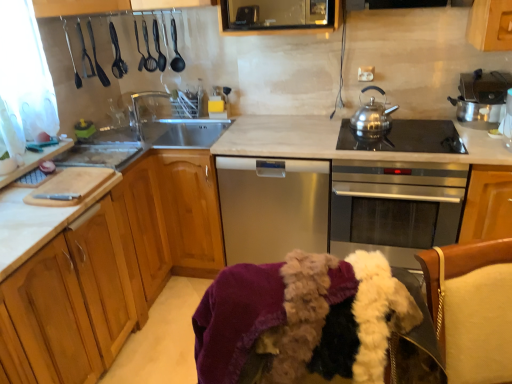
Question: Considering the positions of stainless steel teapot at upper right and stainless steel oven at center in the image, is stainless steel teapot at upper right taller or shorter than stainless steel oven at center?

Choices:
 (A) short
 (B) tall

Answer: (A)

Question: From a real-world perspective, is stainless steel teapot at upper right positioned above or below stainless steel oven at center?

Choices:
 (A) below
 (B) above

Answer: (B)

Question: Which object is positioned closest to the wooden cabinet at center, which is counted as the first cabinetry, starting from the right?

Choices:
 (A) stainless steel oven at center
 (B) black plastic spoon at upper center, arranged as the 1th appliance when viewed from the top
 (C) satin silver dishwasher at center
 (D) black glass cooktop at center-right
 (E) shiny metallic pot at upper right, the second appliance from the top

Answer: (C)

Question: Which object is positioned farthest from the white marble countertop at center?

Choices:
 (A) stainless steel oven at center
 (B) wooden cabinet at center, which ranks as the second cabinetry in left-to-right order
 (C) shiny metallic pot at upper right, arranged as the first appliance when viewed from the right
 (D) transparent glass tap at center
 (E) black glass cooktop at center-right

Answer: (D)